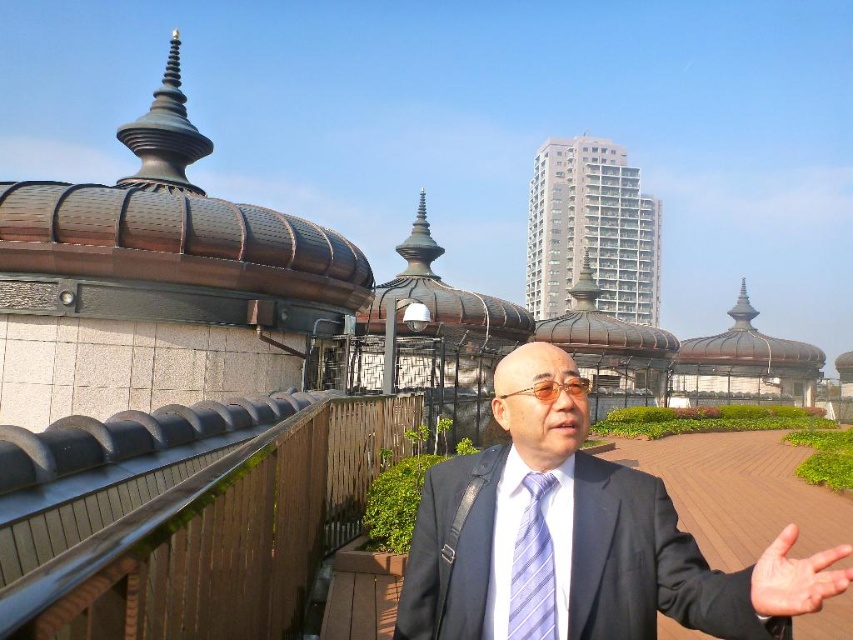
Question: Which object appears farthest from the camera in this image?

Choices:
 (A) matte black suit at center
 (B) light skin hand at center

Answer: (A)

Question: Can you confirm if light blue striped tie at center is smaller than light skin hand at center?

Choices:
 (A) no
 (B) yes

Answer: (B)

Question: Among these objects, which one is farthest from the camera?

Choices:
 (A) matte black suit at center
 (B) light blue striped tie at center
 (C) light skin hand at center

Answer: (B)

Question: In this image, where is matte black suit at center located relative to light skin hand at center?

Choices:
 (A) below
 (B) above

Answer: (A)

Question: Does matte black suit at center appear on the left side of light skin hand at center?

Choices:
 (A) yes
 (B) no

Answer: (A)

Question: Among these objects, which one is farthest from the camera?

Choices:
 (A) matte black suit at center
 (B) light skin hand at center
 (C) light blue striped tie at center

Answer: (C)